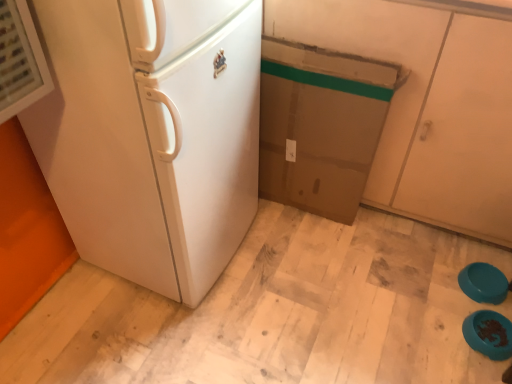
What are the coordinates of `free area in between white matte refrigerator at left and teal plastic bowls at lower right, the 2th appliance viewed from the front` in the screenshot? It's located at (331, 273).